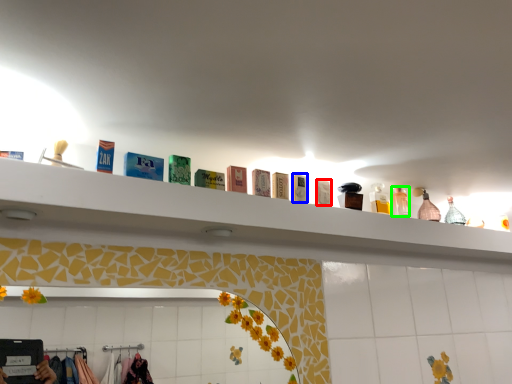
Question: Which object is the closest to the toiletry (highlighted by a red box)? Choose among these: toiletry (highlighted by a blue box) or toiletry (highlighted by a green box).

Choices:
 (A) toiletry
 (B) toiletry

Answer: (A)